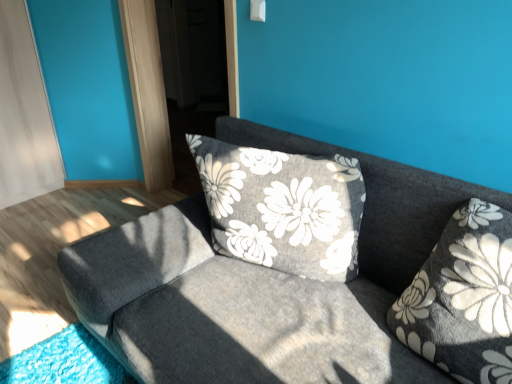
This screenshot has height=384, width=512. In order to click on transparent glass screen door at upper center in this screenshot , I will do `click(199, 54)`.

Between fluffy gray pillow at right and transparent glass screen door at upper center, which one appears on the left side from the viewer's perspective?

transparent glass screen door at upper center is more to the left.

Choose the correct answer: Is fluffy gray pillow at right inside transparent glass screen door at upper center or outside it?

fluffy gray pillow at right lies outside transparent glass screen door at upper center.

Considering the sizes of objects fluffy gray pillow at right and transparent glass screen door at upper center in the image provided, who is bigger, fluffy gray pillow at right or transparent glass screen door at upper center?

transparent glass screen door at upper center.

From the image's perspective, between fluffy gray pillow at right and transparent glass screen door at upper center, who is located below?

fluffy gray pillow at right.

From a real-world perspective, is textured gray couch at center on top of transparent glass screen door at upper center?

No, from a real-world perspective, textured gray couch at center is not over transparent glass screen door at upper center

From the image's perspective, does textured gray couch at center appear higher than transparent glass screen door at upper center?

No, from the image's perspective, textured gray couch at center is not over transparent glass screen door at upper center.

Would you say textured gray couch at center contains transparent glass screen door at upper center?

That's incorrect, transparent glass screen door at upper center is not inside textured gray couch at center.

Relative to fluffy gray pillow at right, is transparent glass screen door at upper center in front or behind?

Visually, transparent glass screen door at upper center is located behind fluffy gray pillow at right.

Does transparent glass screen door at upper center turn towards fluffy gray pillow at right?

No, transparent glass screen door at upper center does not turn towards fluffy gray pillow at right.

From the image's perspective, is transparent glass screen door at upper center on fluffy gray pillow at right?

Yes.

Would you say transparent glass screen door at upper center is to the left or to the right of fluffy gray pillow at right in the picture?

transparent glass screen door at upper center is to the left of fluffy gray pillow at right.

Is transparent glass screen door at upper center surrounding textured gray couch at center?

No, textured gray couch at center is located outside of transparent glass screen door at upper center.

Is transparent glass screen door at upper center to the left of textured gray couch at center from the viewer's perspective?

Yes, transparent glass screen door at upper center is to the left of textured gray couch at center.

In the image, is transparent glass screen door at upper center positioned in front of or behind textured gray couch at center?

Visually, transparent glass screen door at upper center is located behind textured gray couch at center.

Is transparent glass screen door at upper center next to textured gray couch at center and touching it?

No, transparent glass screen door at upper center is not making contact with textured gray couch at center.

Is textured gray couch at center oriented towards fluffy gray pillow at right?

No.

Relative to fluffy gray pillow at right, is textured gray couch at center in front or behind?

Clearly, textured gray couch at center is in front of fluffy gray pillow at right.

Find the location of a particular element. pillow that is on the right side of textured gray couch at center is located at coordinates (463, 298).

How different are the orientations of textured gray couch at center and fluffy gray pillow at right in degrees?

2.15 degrees separate the facing orientations of textured gray couch at center and fluffy gray pillow at right.

From a real-world perspective, between fluffy gray pillow at right and textured gray couch at center, who is vertically higher?

In real-world perspective, fluffy gray pillow at right is above.

Is fluffy gray pillow at right to the right of textured gray couch at center from the viewer's perspective?

Yes, fluffy gray pillow at right is to the right of textured gray couch at center.

Which of these two, fluffy gray pillow at right or textured gray couch at center, is bigger?

textured gray couch at center.

Considering the relative sizes of fluffy gray pillow at right and textured gray couch at center in the image provided, is fluffy gray pillow at right taller than textured gray couch at center?

Incorrect, the height of fluffy gray pillow at right is not larger of that of textured gray couch at center.

You are a GUI agent. You are given a task and a screenshot of the screen. Output one action in this format:
    pyautogui.click(x=<x>, y=<y>)
    Task: Click on the screen door that appears above the fluffy gray pillow at right (from a real-world perspective)
    
    Given the screenshot: What is the action you would take?
    pyautogui.click(x=199, y=54)

Identify the location of screen door above the textured gray couch at center (from the image's perspective). (199, 54).

From the image, which object appears to be farther from textured gray couch at center, fluffy gray pillow at right or transparent glass screen door at upper center?

transparent glass screen door at upper center.

Looking at the image, which one is located further to fluffy gray pillow at right, transparent glass screen door at upper center or textured gray couch at center?

transparent glass screen door at upper center is positioned further to the anchor fluffy gray pillow at right.

Based on their spatial positions, is transparent glass screen door at upper center or fluffy gray pillow at right closer to textured gray couch at center?

Among the two, fluffy gray pillow at right is located nearer to textured gray couch at center.

When comparing their distances from transparent glass screen door at upper center, does fluffy gray pillow at right or textured gray couch at center seem closer?

textured gray couch at center is positioned closer to the anchor transparent glass screen door at upper center.

Based on their spatial positions, is textured gray couch at center or transparent glass screen door at upper center further from fluffy gray pillow at right?

Based on the image, transparent glass screen door at upper center appears to be further to fluffy gray pillow at right.

When comparing their distances from transparent glass screen door at upper center, does textured gray couch at center or fluffy gray pillow at right seem further?

fluffy gray pillow at right is positioned further to the anchor transparent glass screen door at upper center.

Locate an element on the screen. Image resolution: width=512 pixels, height=384 pixels. pillow between textured gray couch at center and transparent glass screen door at upper center along the z-axis is located at coordinates (463, 298).